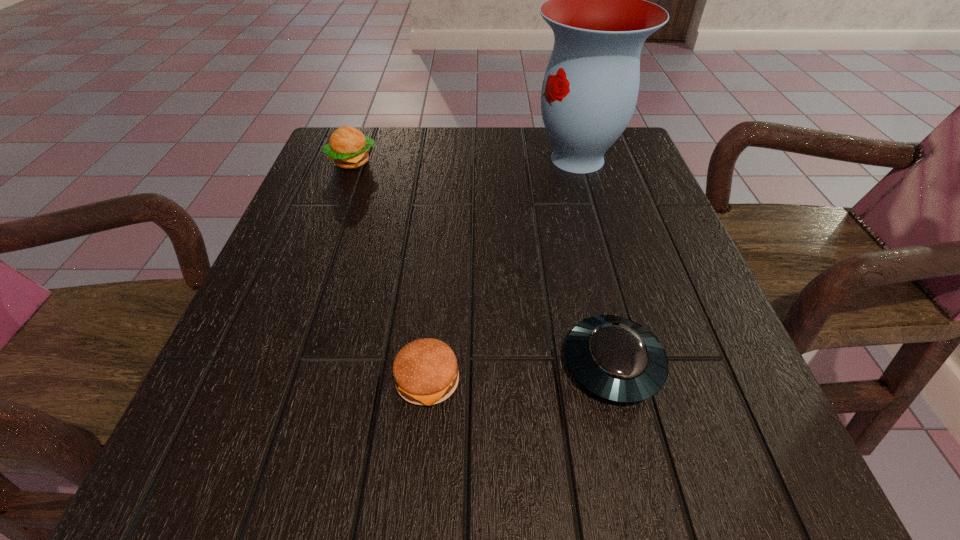
Find the location of a particular element. This screenshot has height=540, width=960. vacant space that is in between the tallest object and the right hamburger is located at coordinates (502, 269).

Locate an element on the screen. unoccupied area between the third object from right to left and the saucer is located at coordinates tap(520, 372).

Locate an element on the screen. free space between the shorter hamburger and the saucer is located at coordinates (520, 372).

Find the location of `object that ranks as the third closest to the right hamburger`. object that ranks as the third closest to the right hamburger is located at coordinates (349, 148).

Point out which object is positioned as the second nearest to the third shortest object. Please provide its 2D coordinates. Your answer should be formatted as a tuple, i.e. [(x, y)], where the tuple contains the x and y coordinates of a point satisfying the conditions above.

[(425, 371)]

Where is `free space that satisfies the following two spatial constraints: 1. on the back side of the vase; 2. on the right side of the taller hamburger`? free space that satisfies the following two spatial constraints: 1. on the back side of the vase; 2. on the right side of the taller hamburger is located at coordinates (353, 159).

This screenshot has height=540, width=960. I want to click on vacant area that satisfies the following two spatial constraints: 1. on the back side of the saucer; 2. on the right side of the right hamburger, so click(x=429, y=364).

Where is `vacant space that satisfies the following two spatial constraints: 1. on the back side of the right hamburger; 2. on the left side of the tallest object`? vacant space that satisfies the following two spatial constraints: 1. on the back side of the right hamburger; 2. on the left side of the tallest object is located at coordinates (448, 159).